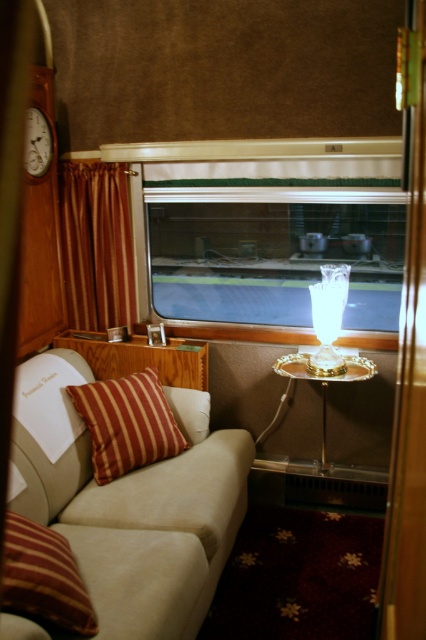
Can you confirm if velvet burgundy curtain at left is positioned above gold metallic side table at center?

Indeed, velvet burgundy curtain at left is positioned over gold metallic side table at center.

Between velvet burgundy curtain at left and gold metallic side table at center, which one appears on the right side from the viewer's perspective?

gold metallic side table at center

From the picture: Who is more forward, (103, 317) or (281, 362)?

Point (281, 362)

In order to click on velvet burgundy curtain at left in this screenshot , I will do `click(95, 244)`.

Between clear glass window at center and wooden clock at upper left, which one has more height?

Standing taller between the two is clear glass window at center.

Is clear glass window at center to the right of wooden clock at upper left from the viewer's perspective?

Yes, clear glass window at center is to the right of wooden clock at upper left.

I want to click on clear glass window at center, so click(x=273, y=253).

Is velvet burgundy curtain at left above wooden clock at upper left?

No.

At what (x,y) coordinates should I click in order to perform the action: click on velvet burgundy curtain at left. Please return your answer as a coordinate pair (x, y). Looking at the image, I should click on (95, 244).

This screenshot has height=640, width=426. In order to click on velvet burgundy curtain at left in this screenshot , I will do `click(95, 244)`.